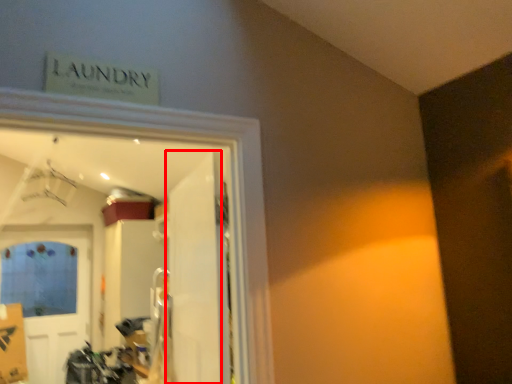
Question: From the image's perspective, where is door (annotated by the red box) located in relation to door in the image?

Choices:
 (A) above
 (B) below

Answer: (A)